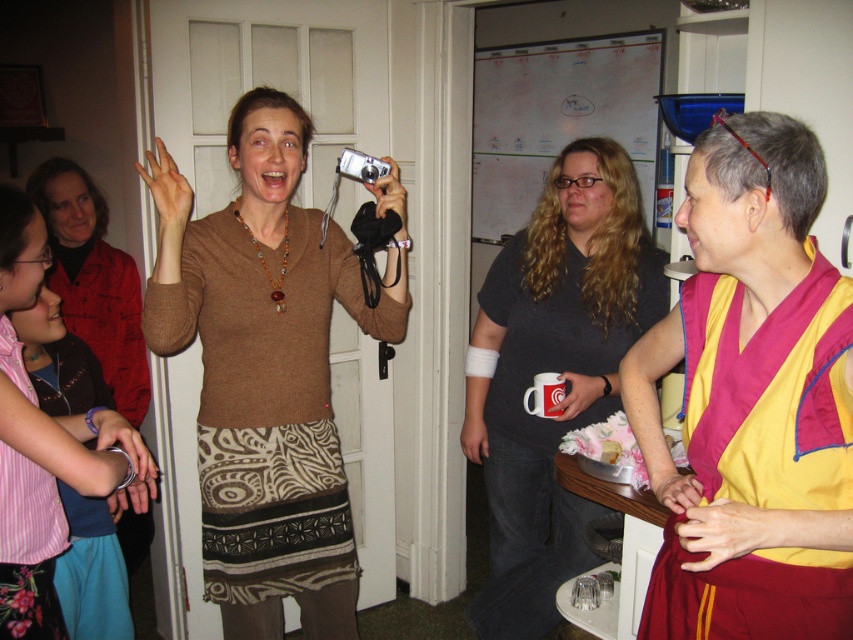
Question: Which point is farther to the camera?

Choices:
 (A) (788, 163)
 (B) (340, 156)
 (C) (606, 248)

Answer: (C)

Question: Is dark gray t-shirt at center smaller than silver metallic camera at upper center?

Choices:
 (A) no
 (B) yes

Answer: (A)

Question: Which point is closer to the camera?

Choices:
 (A) (532, 595)
 (B) (787, 321)
 (C) (38, 220)

Answer: (B)

Question: Does brown sweater at center have a smaller size compared to dark gray t-shirt at center?

Choices:
 (A) yes
 (B) no

Answer: (B)

Question: Is matte brown sweater at center to the right of silver metallic camera at upper center from the viewer's perspective?

Choices:
 (A) no
 (B) yes

Answer: (A)

Question: Which is nearer to the brown sweater at center?

Choices:
 (A) maroon silk robe at right
 (B) matte brown sweater at center
 (C) silver metallic camera at upper center
 (D) dark gray t-shirt at center

Answer: (B)